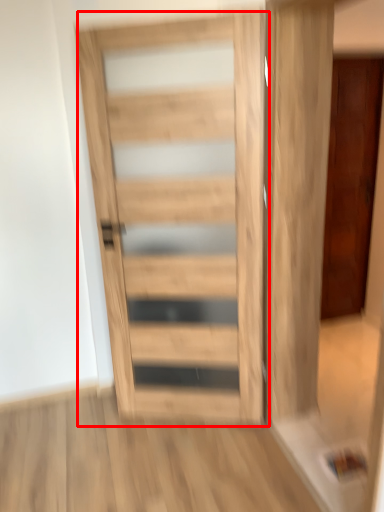
Question: From the image, what is the correct spatial relationship of door (annotated by the red box) in relation to door?

Choices:
 (A) left
 (B) right

Answer: (A)